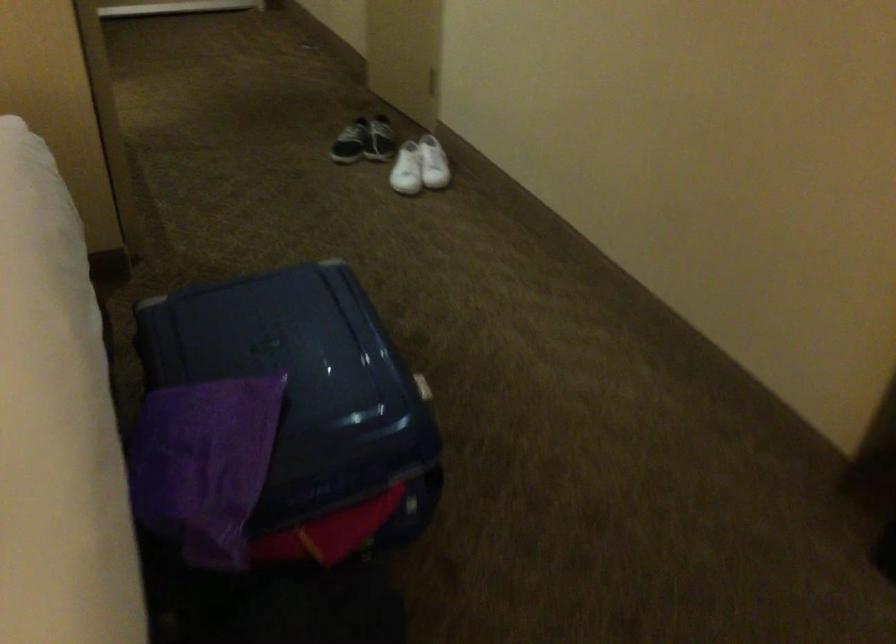
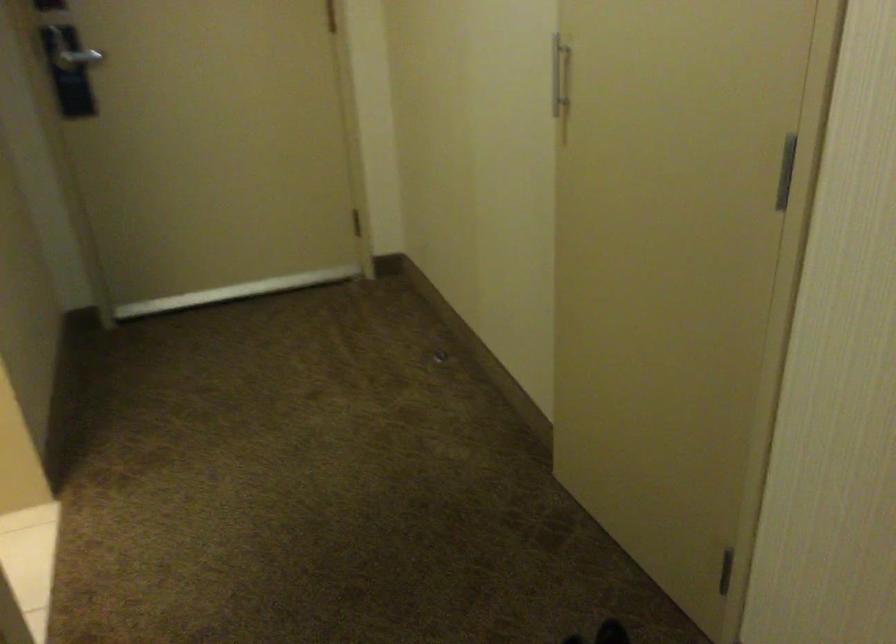
Question: In a continuous first-person perspective shot, in which direction is the camera moving?

Choices:
 (A) Left
 (B) Right
 (C) Forward
 (D) Backward

Answer: (C)